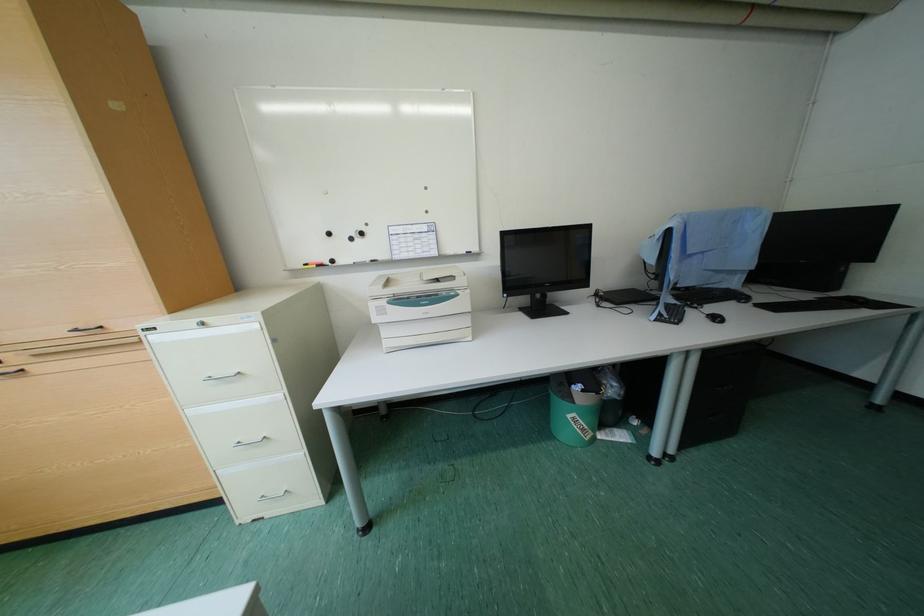
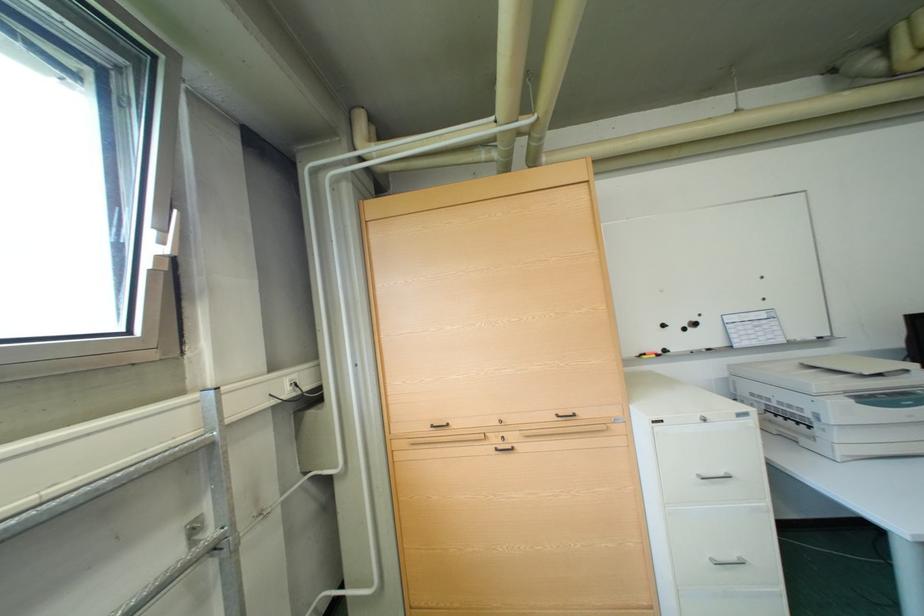
Question: Which direction would the cameraman need to move to produce the second image? Reply with the corresponding letter.

Choices:
 (A) Left
 (B) Right
 (C) Forward
 (D) Backward

Answer: (A)